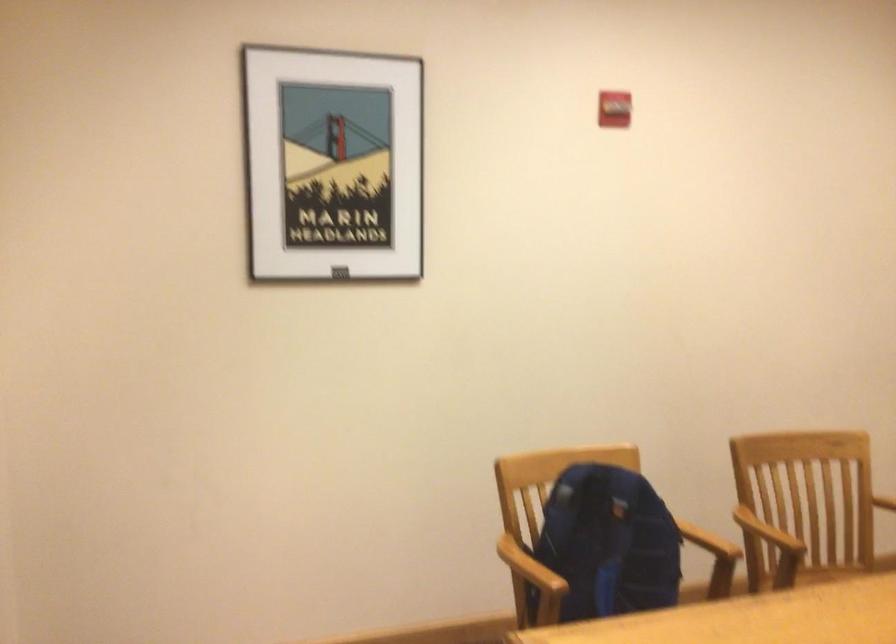
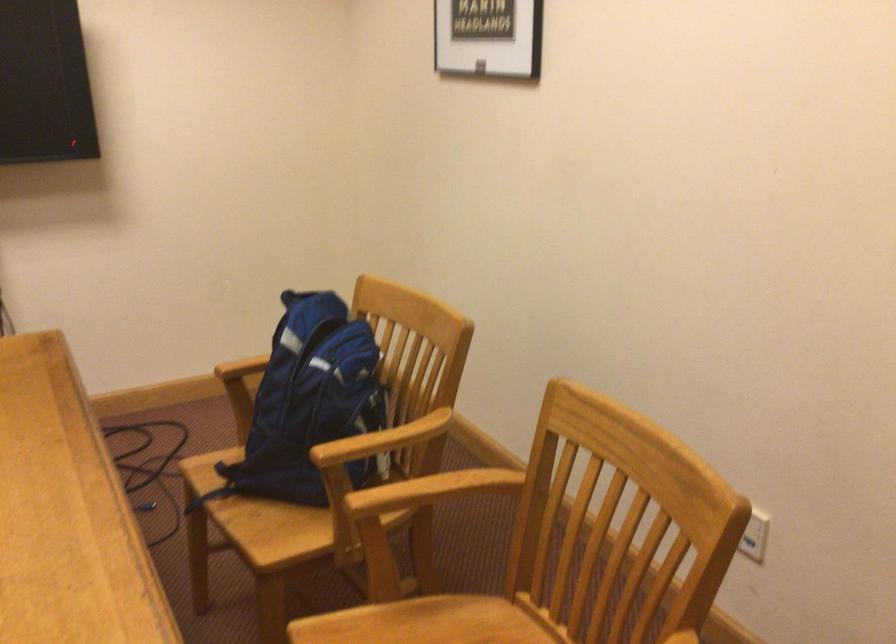
Where in the second image is the point corresponding to point (686, 540) from the first image?

(383, 440)